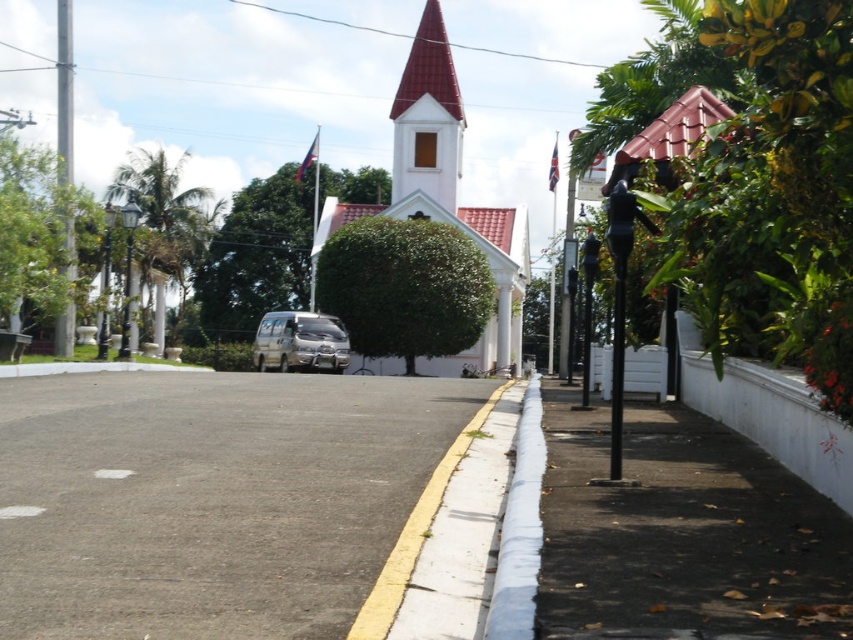
Is white matte church at center closer to camera compared to silver metallic van at center?

That is False.

Image resolution: width=853 pixels, height=640 pixels. I want to click on white matte church at center, so click(445, 193).

This screenshot has height=640, width=853. What are the coordinates of `white matte church at center` in the screenshot? It's located at (445, 193).

Is the position of gray asphalt pavement at center less distant than that of white wood spire at center?

Yes, it is.

The width and height of the screenshot is (853, 640). Identify the location of gray asphalt pavement at center. (209, 499).

Find the location of a particular element. gray asphalt pavement at center is located at coordinates click(x=209, y=499).

This screenshot has width=853, height=640. What do you see at coordinates (445, 193) in the screenshot?
I see `white matte church at center` at bounding box center [445, 193].

Can you confirm if white matte church at center is bigger than white wood spire at center?

Yes, white matte church at center is bigger than white wood spire at center.

Find the location of a particular element. This screenshot has width=853, height=640. white matte church at center is located at coordinates (445, 193).